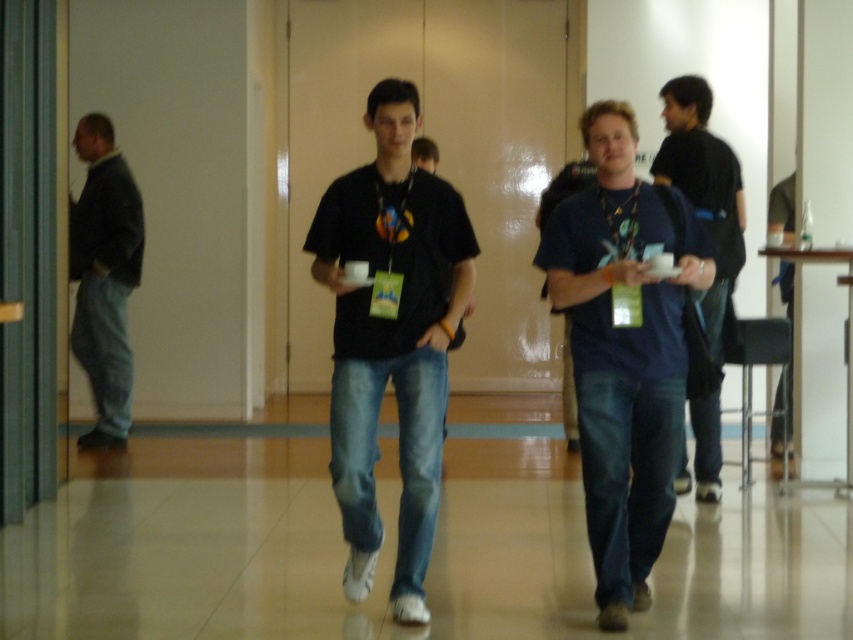
Question: Which point is farther to the camera?

Choices:
 (A) dark blue jeans at left
 (B) dark blue jeans at right

Answer: (A)

Question: Can you confirm if blue cotton t-shirt at center is wider than dark blue jeans at left?

Choices:
 (A) no
 (B) yes

Answer: (B)

Question: Which point appears farthest from the camera in this image?

Choices:
 (A) (691, 428)
 (B) (93, 292)
 (C) (790, 195)

Answer: (B)

Question: In this image, where is dark blue jeans at left located relative to dark blue jeans at center?

Choices:
 (A) right
 (B) left

Answer: (B)

Question: Which of the following is the closest to the observer?

Choices:
 (A) dark blue jeans at center
 (B) dark blue jeans at right
 (C) blue cotton t-shirt at center

Answer: (C)

Question: Can you confirm if blue cotton t-shirt at center is positioned below dark blue jeans at left?

Choices:
 (A) yes
 (B) no

Answer: (A)